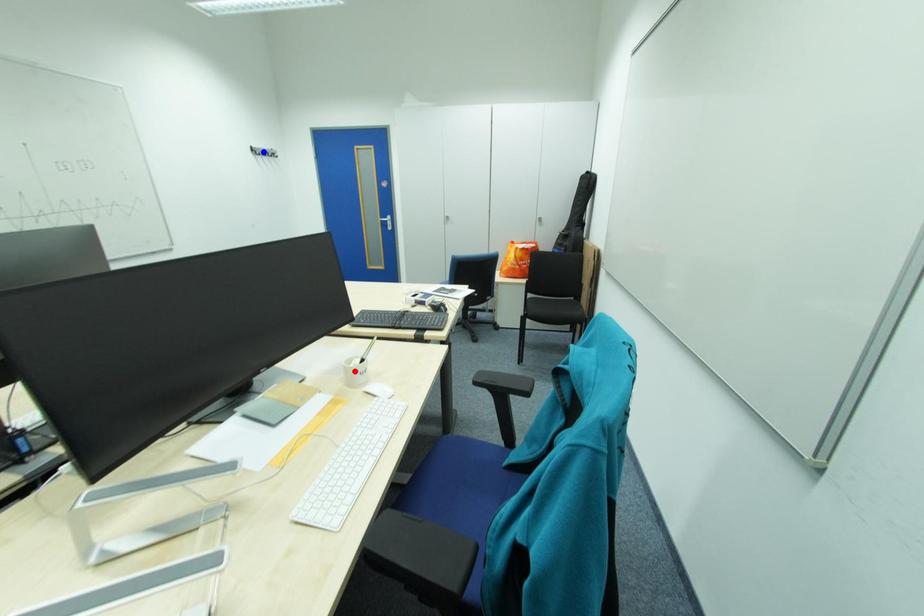
Question: Which of the two points in the image is closer to the camera?

Choices:
 (A) Blue point is closer.
 (B) Red point is closer.

Answer: (B)